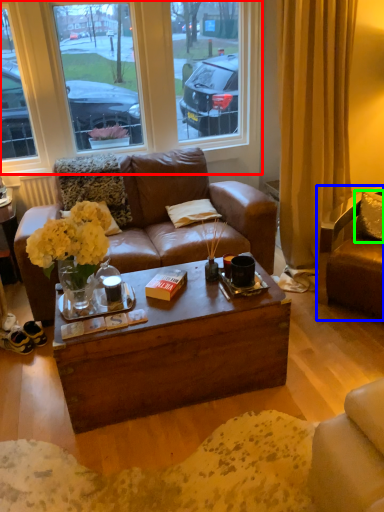
Question: Which object is the farthest from window (highlighted by a red box)? Choose among these: chair (highlighted by a blue box) or pillow (highlighted by a green box).

Choices:
 (A) chair
 (B) pillow

Answer: (A)